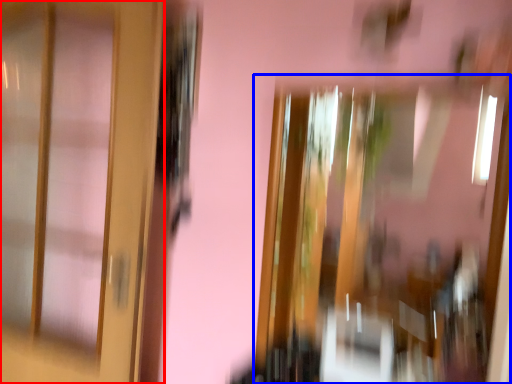
Question: Which of the following is the farthest to the observer, door (highlighted by a red box) or window (highlighted by a blue box)?

Choices:
 (A) door
 (B) window

Answer: (A)